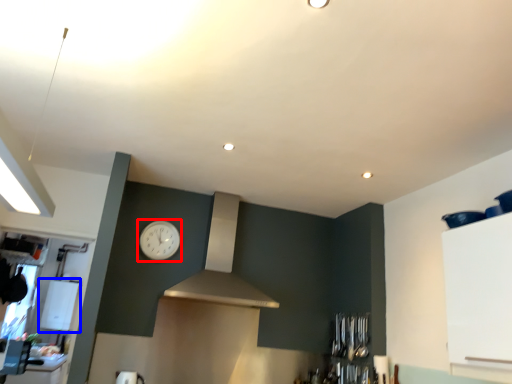
Question: Which of the following is the farthest to the observer, clock (highlighted by a red box) or appliance (highlighted by a blue box)?

Choices:
 (A) clock
 (B) appliance

Answer: (B)